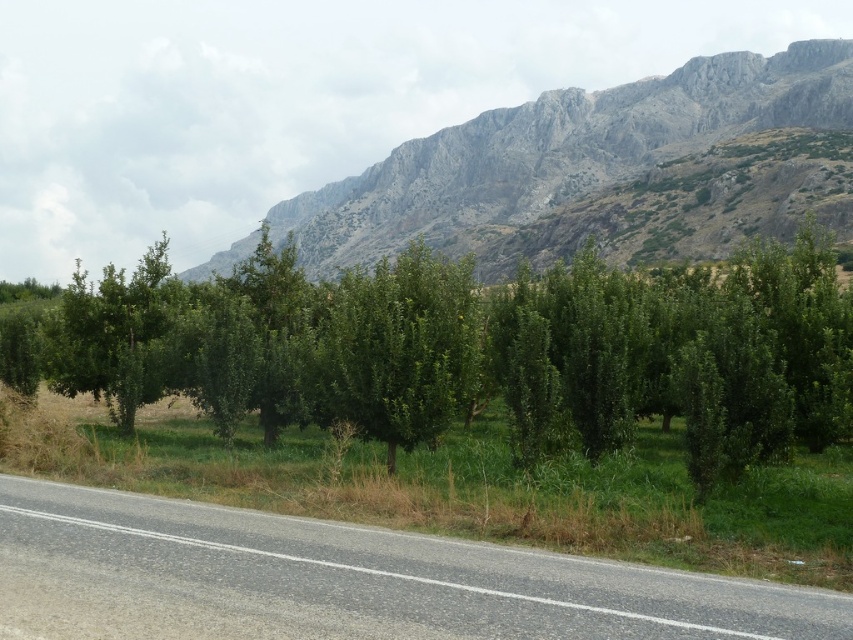
Is gray asphalt road at lower left wider than gray rocky mountain at upper center?

Incorrect, gray asphalt road at lower left's width does not surpass gray rocky mountain at upper center's.

Describe the element at coordinates (344, 580) in the screenshot. This screenshot has width=853, height=640. I see `gray asphalt road at lower left` at that location.

Where is `gray asphalt road at lower left`? gray asphalt road at lower left is located at coordinates (344, 580).

Identify the location of gray asphalt road at lower left. (344, 580).

Who is more distant from viewer, (361,394) or (619,625)?

The point (361,394) is behind.

This screenshot has width=853, height=640. I want to click on green leafy tree at center, so click(473, 349).

Where is `green leafy tree at center`? The height and width of the screenshot is (640, 853). green leafy tree at center is located at coordinates (473, 349).

Can you confirm if green leafy tree at center is positioned to the left of gray rocky mountain at upper center?

No, green leafy tree at center is not to the left of gray rocky mountain at upper center.

Which is behind, point (486, 301) or point (548, 124)?

Point (548, 124)

At what (x,y) coordinates should I click in order to perform the action: click on green leafy tree at center. Please return your answer as a coordinate pair (x, y). Image resolution: width=853 pixels, height=640 pixels. Looking at the image, I should click on (473, 349).